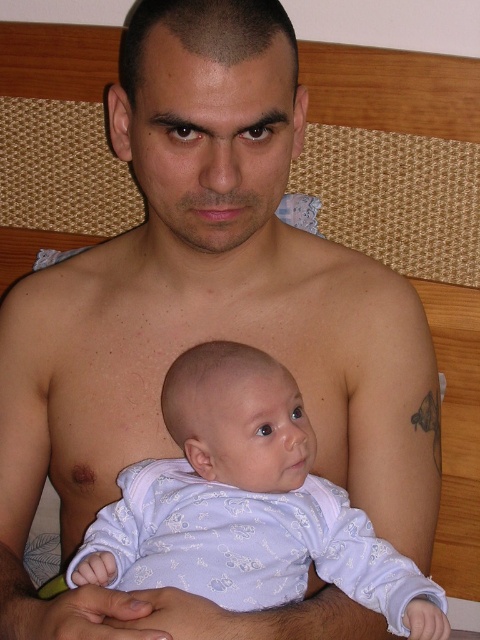
Question: Is wooden headboard at upper center below light purple fabric baby at center?

Choices:
 (A) yes
 (B) no

Answer: (B)

Question: Which point appears farthest from the camera in this image?

Choices:
 (A) click(x=66, y=99)
 (B) click(x=220, y=516)

Answer: (A)

Question: Which object appears closest to the camera in this image?

Choices:
 (A) wooden headboard at upper center
 (B) light purple fabric baby at center

Answer: (B)

Question: Observing the image, what is the correct spatial positioning of wooden headboard at upper center in reference to light purple fabric baby at center?

Choices:
 (A) above
 (B) below

Answer: (A)

Question: Does wooden headboard at upper center appear on the left side of light purple fabric baby at center?

Choices:
 (A) no
 (B) yes

Answer: (A)